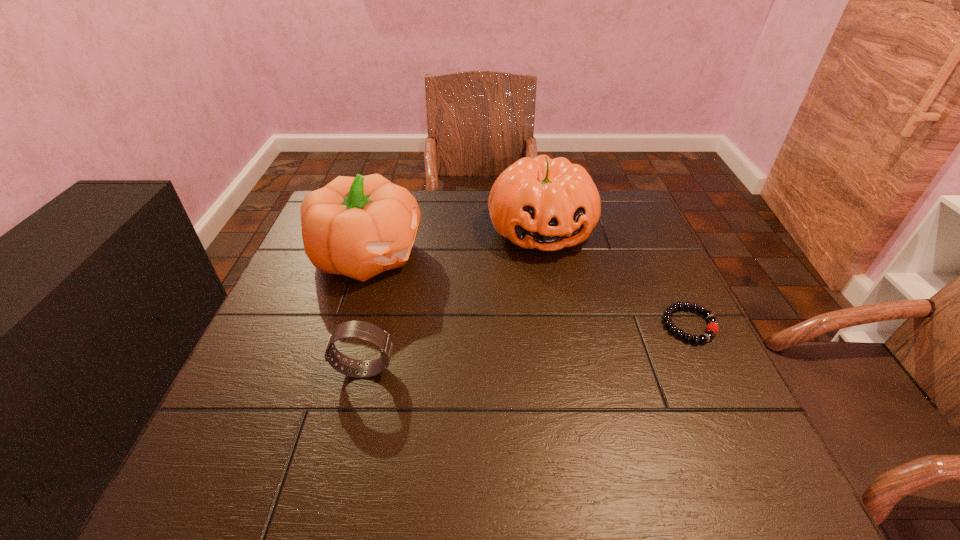
This screenshot has height=540, width=960. I want to click on vacant space on the desktop that is between the third tallest object and the rightmost object and is positioned on the carved face of the left pumpkin, so click(x=571, y=341).

You are a GUI agent. You are given a task and a screenshot of the screen. Output one action in this format:
    pyautogui.click(x=<x>, y=<y>)
    Task: Click on the free space on the desktop that is between the third tallest object and the shortest object and is positioned on the carved face of the right pumpkin
    The height and width of the screenshot is (540, 960).
    Given the screenshot: What is the action you would take?
    pyautogui.click(x=574, y=341)